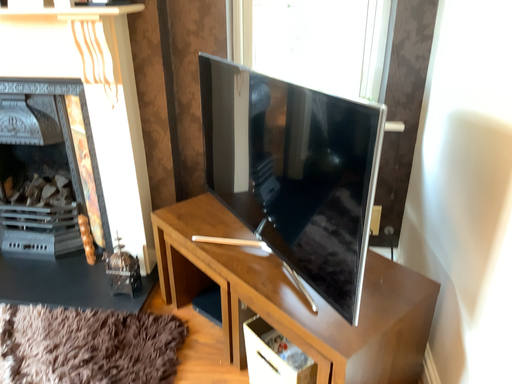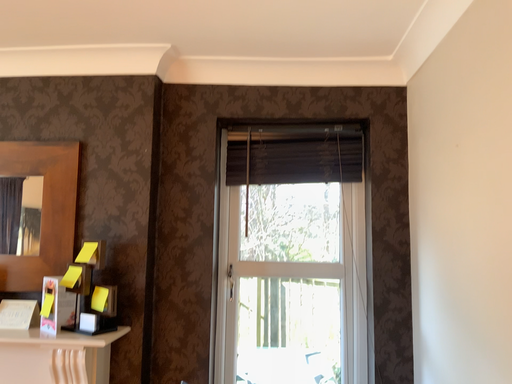
Question: Which way did the camera rotate in the video?

Choices:
 (A) rotated downward
 (B) rotated upward

Answer: (B)